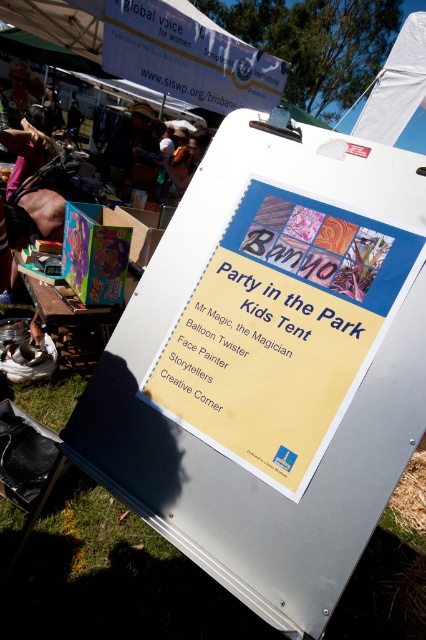
You are standing at the camera position looking at the signboard. A small sticker is placed at point (241, 216) on the signboard. If you want to place another sticker exactly 5 feet away from the first one on the same signboard, is it possible?

The distance between point (241, 216) and the camera is 4.52 feet. Since the desired distance of 5 feet exceeds this distance, placing the second sticker 5 feet away from the first on the signboard would not be possible as it would require extending beyond the signboard.

You are at the community event and want to read the signboard. Which sign should you look at first if you start from the top? The yellow paper sign at center or the white paper sign at upper center?

The white paper sign at upper center should be looked at first since it is positioned above the yellow paper sign at center.

You are at a community event and want to locate the main signboard. Based on the coordinates provided, where should you look to find the yellow paper sign at center?

The yellow paper sign at center is located at coordinates point (282, 330).